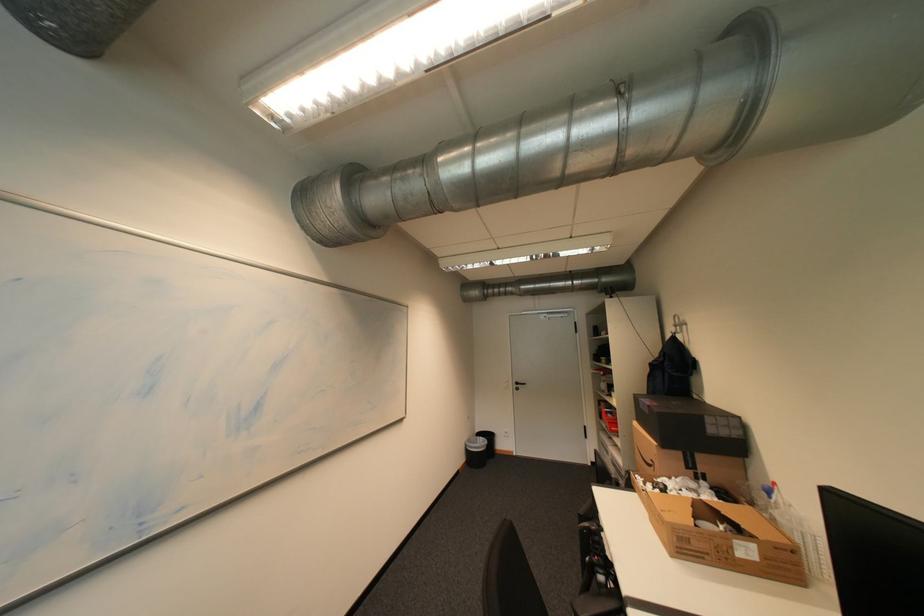
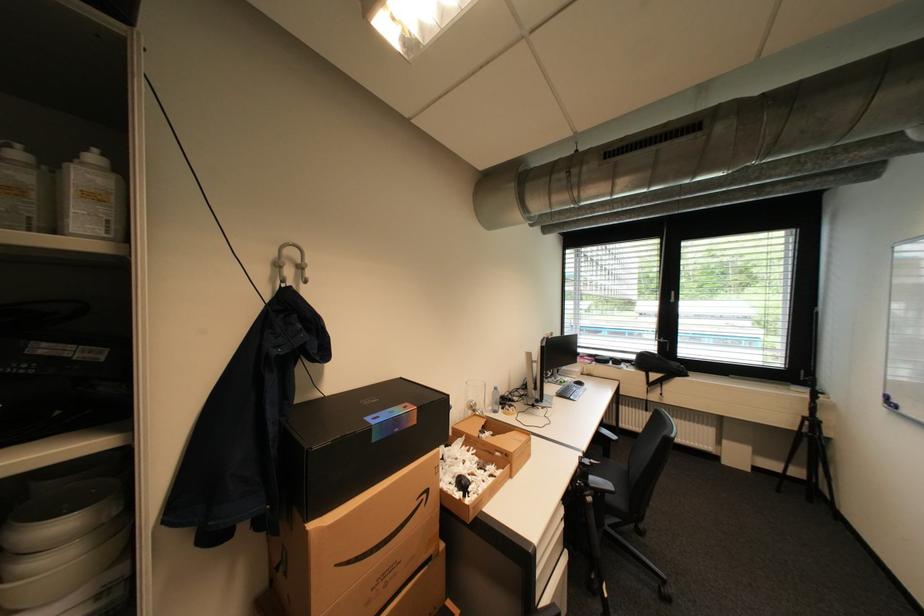
In the second image, find the point that corresponds to [748,525] in the first image.

(492, 426)